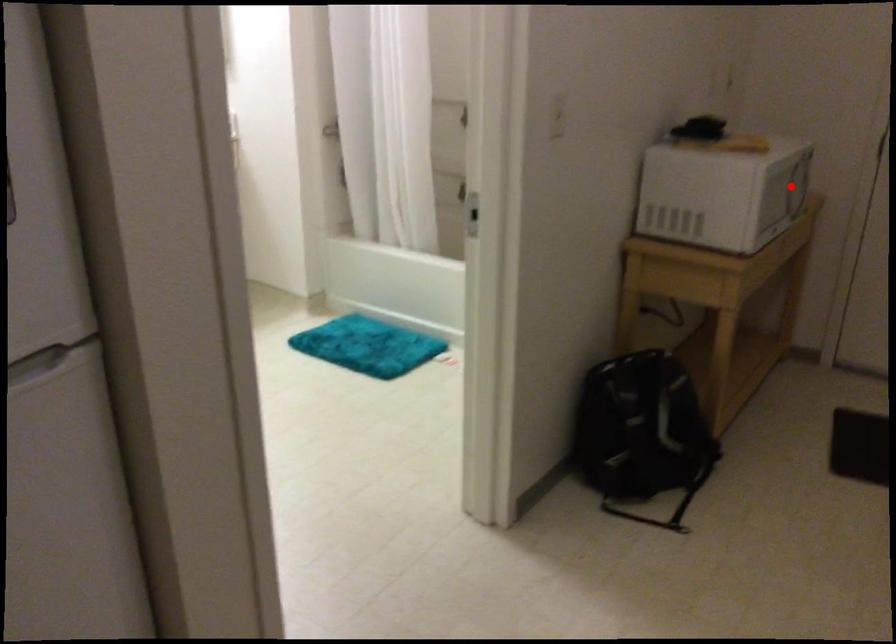
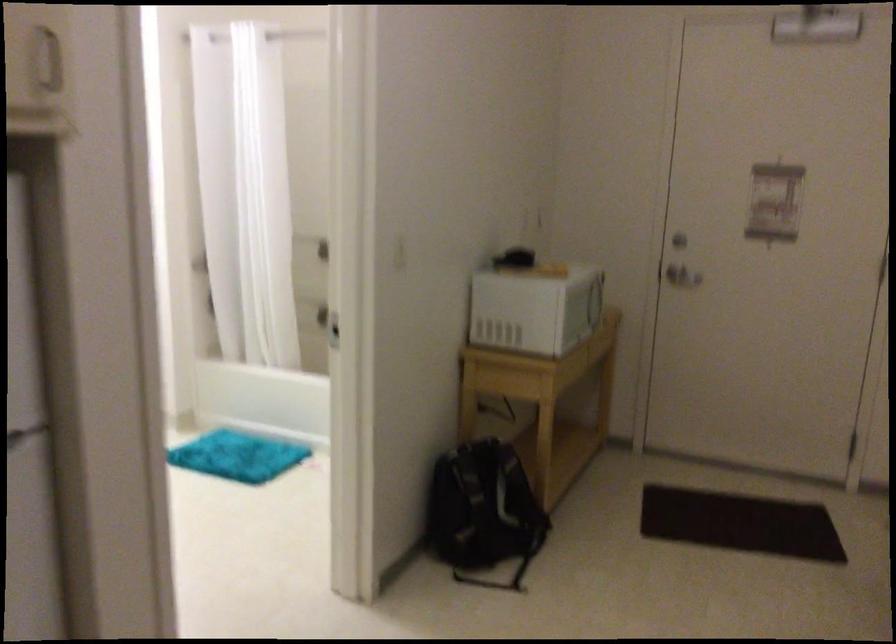
Question: I am providing you with two images of the same scene from different viewpoints. Image1 has a red point marked. In image2, the corresponding 3D location appears at what relative position? Reply with the corresponding letter.

Choices:
 (A) Closer
 (B) Farther

Answer: (B)